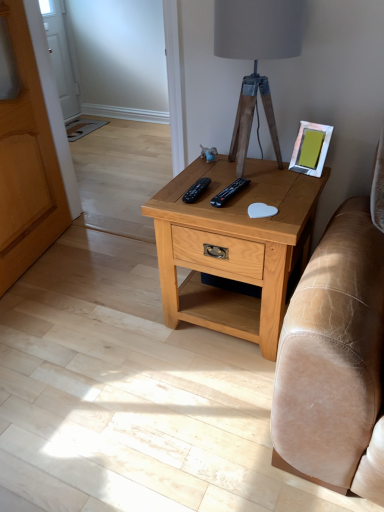
Where is `vacant space in front of black plastic remote at center, which is the second remote in left-to-right order`? This screenshot has width=384, height=512. vacant space in front of black plastic remote at center, which is the second remote in left-to-right order is located at coordinates (245, 214).